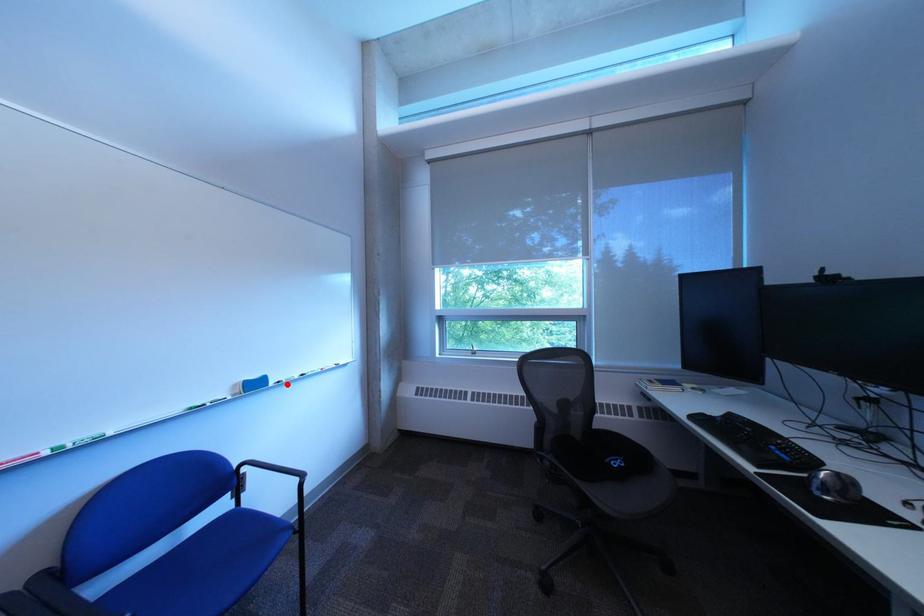
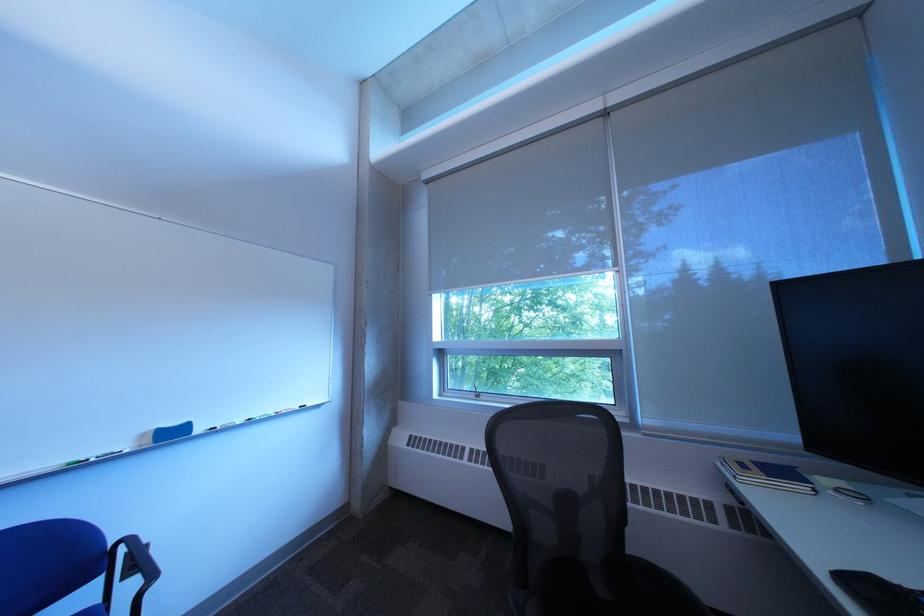
Find the pixel in the second image that matches the highlighted location in the first image.

(213, 432)